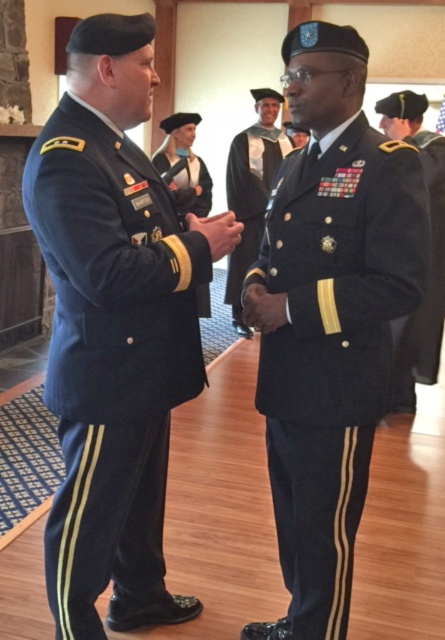
Question: Can you confirm if navy blue fabric uniform at center is smaller than shiny black uniform at center?

Choices:
 (A) no
 (B) yes

Answer: (B)

Question: Which point is closer to the camera?

Choices:
 (A) shiny black uniform at right
 (B) matte black uniform at center
 (C) shiny black uniform at center
 (D) navy blue fabric uniform at center

Answer: (D)

Question: Estimate the real-world distances between objects in this image. Which object is closer to the navy blue fabric uniform at center?

Choices:
 (A) matte black uniform at center
 (B) shiny black uniform at right

Answer: (B)

Question: In this image, where is navy blue fabric uniform at left located relative to matte black uniform at center?

Choices:
 (A) above
 (B) below

Answer: (B)

Question: Is navy blue fabric uniform at left wider than shiny black uniform at center?

Choices:
 (A) yes
 (B) no

Answer: (B)

Question: Which of the following is the farthest from the observer?

Choices:
 (A) (48, 134)
 (B) (296, 552)
 (C) (388, 115)
 (D) (197, 172)

Answer: (D)